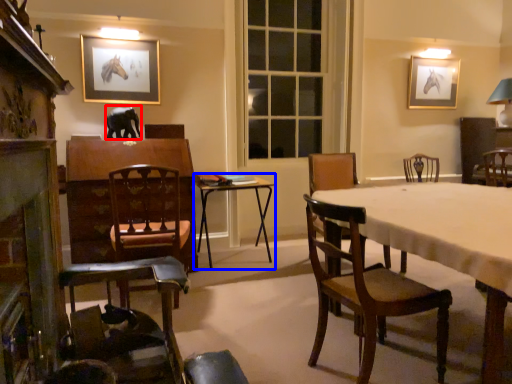
Question: Among these objects, which one is farthest to the camera, animal (highlighted by a red box) or table (highlighted by a blue box)?

Choices:
 (A) animal
 (B) table

Answer: (A)